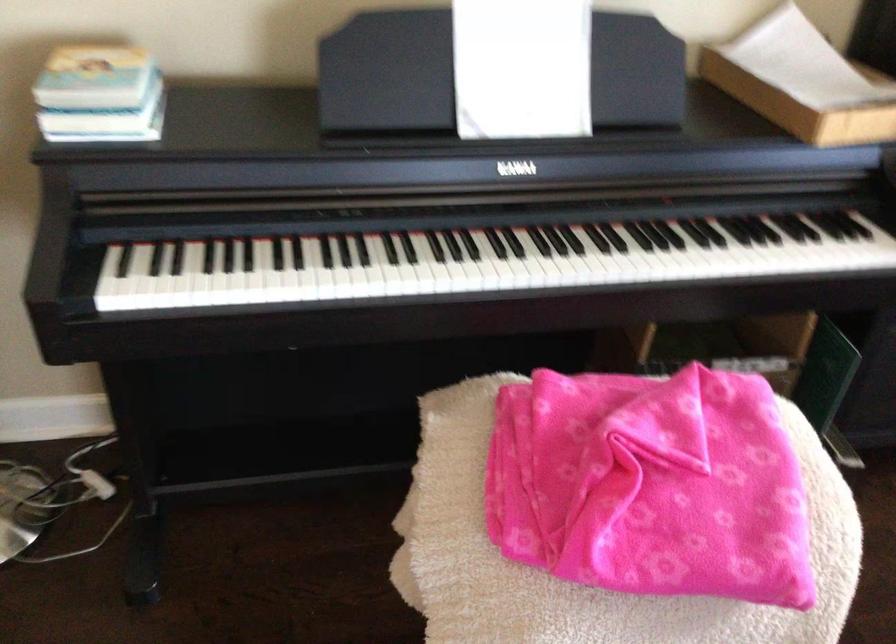
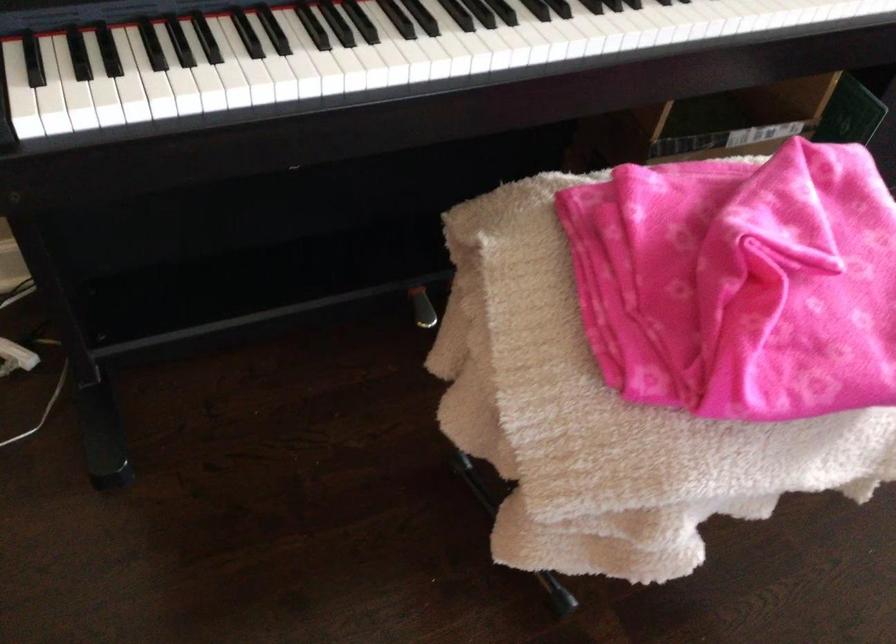
Find the pixel in the second image that matches point (462, 562) in the first image.

(571, 406)